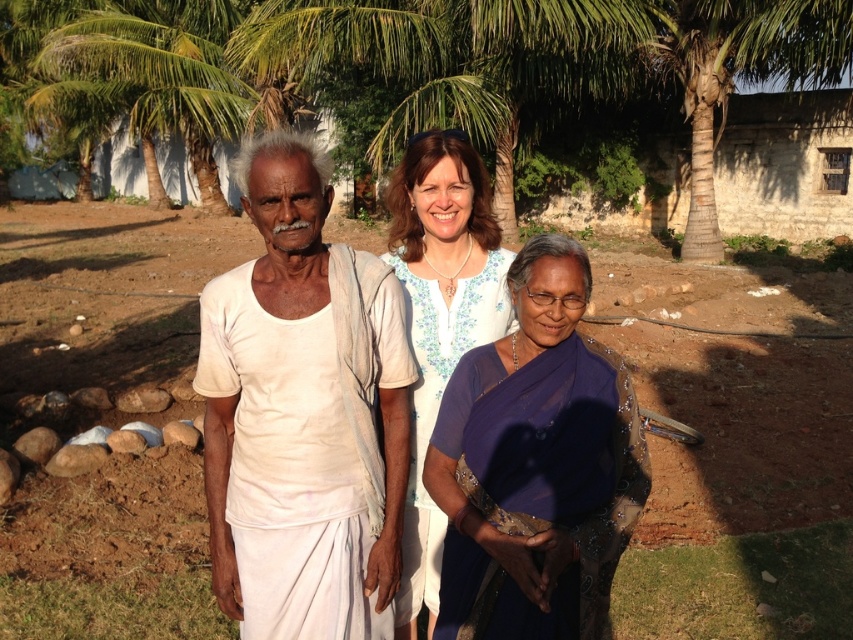
Question: Which object is positioned closest to the purple sheer saree at center?

Choices:
 (A) white cotton shirt at left
 (B) green leafy tree at upper center
 (C) white floral dress at center
 (D) green leafy palm tree at upper left

Answer: (C)

Question: Among these points, which one is farthest from the camera?

Choices:
 (A) (606, 467)
 (B) (480, 337)

Answer: (B)

Question: Is white cotton shirt at center above purple sheer saree at center?

Choices:
 (A) yes
 (B) no

Answer: (A)

Question: Which point is closer to the camera?

Choices:
 (A) (143, 22)
 (B) (643, 42)
 (C) (560, 570)
 (D) (498, 266)

Answer: (C)

Question: Does white cotton shirt at left have a greater width compared to green leafy palm tree at upper left?

Choices:
 (A) yes
 (B) no

Answer: (B)

Question: Is white cotton shirt at left thinner than white cotton shirt at center?

Choices:
 (A) yes
 (B) no

Answer: (B)